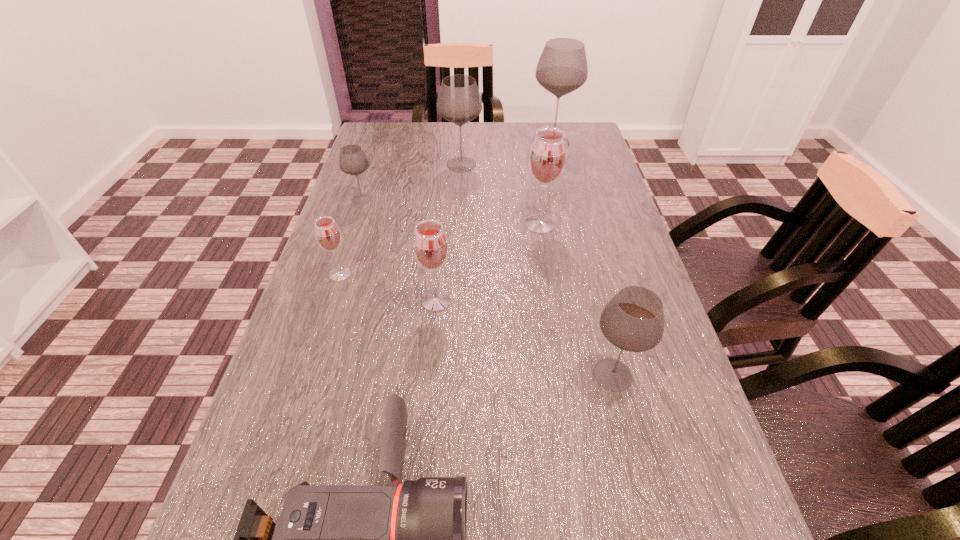
Locate an element on the screen. The image size is (960, 540). the tallest object is located at coordinates (562, 68).

Locate an element on the screen. The height and width of the screenshot is (540, 960). the biggest gray wineglass is located at coordinates (562, 68).

The width and height of the screenshot is (960, 540). What are the coordinates of `the second biggest gray wineglass` in the screenshot? It's located at (459, 101).

This screenshot has width=960, height=540. I want to click on the fourth farthest wineglass, so click(547, 157).

Where is `the fifth nearest object`? The height and width of the screenshot is (540, 960). the fifth nearest object is located at coordinates (547, 157).

Image resolution: width=960 pixels, height=540 pixels. In order to click on the second red wineglass from right to left in this screenshot , I will do `click(430, 245)`.

Find the location of a particular element. The image size is (960, 540). the second biggest red wineglass is located at coordinates (430, 245).

Find the location of a particular element. the nearest wineglass is located at coordinates (633, 320).

Find the location of a particular element. The image size is (960, 540). the nearest gray wineglass is located at coordinates (633, 320).

This screenshot has height=540, width=960. In order to click on the leftmost red wineglass in this screenshot , I will do `click(328, 236)`.